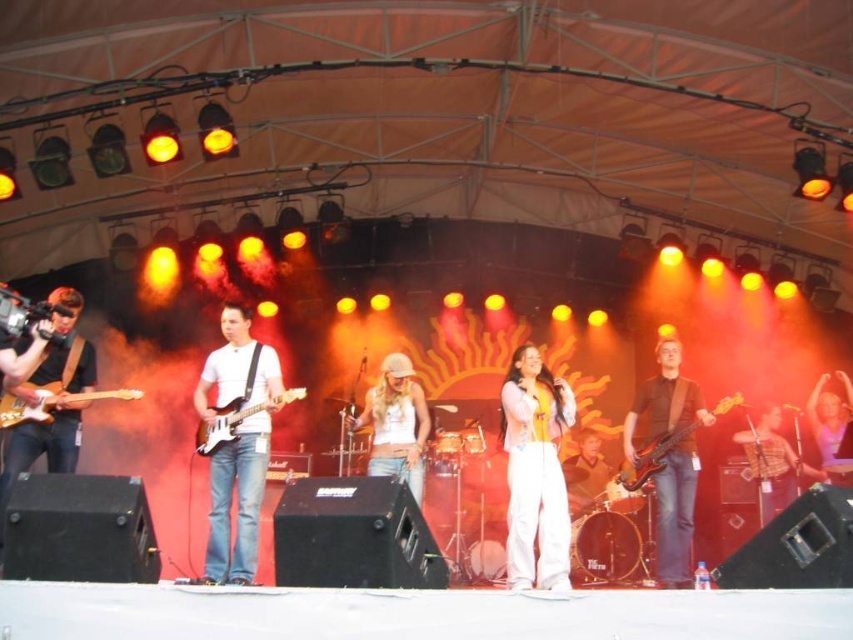
Is metallic silver guitar at right shorter than light brown leather jacket at center?

In fact, metallic silver guitar at right may be taller than light brown leather jacket at center.

Who is taller, metallic silver guitar at right or light brown leather jacket at center?

With more height is metallic silver guitar at right.

You are a GUI agent. You are given a task and a screenshot of the screen. Output one action in this format:
    pyautogui.click(x=<x>, y=<y>)
    Task: Click on the metallic silver guitar at right
    The width and height of the screenshot is (853, 640).
    Given the screenshot: What is the action you would take?
    pyautogui.click(x=769, y=461)

Is point (218, 529) farther from viewer compared to point (399, 400)?

That is False.

Between matte white guitar at center and white cotton tank top at center, which one is positioned higher?

matte white guitar at center

You are a GUI agent. You are given a task and a screenshot of the screen. Output one action in this format:
    pyautogui.click(x=<x>, y=<y>)
    Task: Click on the matte white guitar at center
    The width and height of the screenshot is (853, 640).
    Given the screenshot: What is the action you would take?
    pyautogui.click(x=236, y=444)

Where is `pink fabric at center`? The height and width of the screenshot is (640, 853). pink fabric at center is located at coordinates (831, 424).

Does point (838, 419) lie in front of point (595, 468)?

Yes, it is in front of point (595, 468).

Where is `pink fabric at center`? This screenshot has height=640, width=853. pink fabric at center is located at coordinates (831, 424).